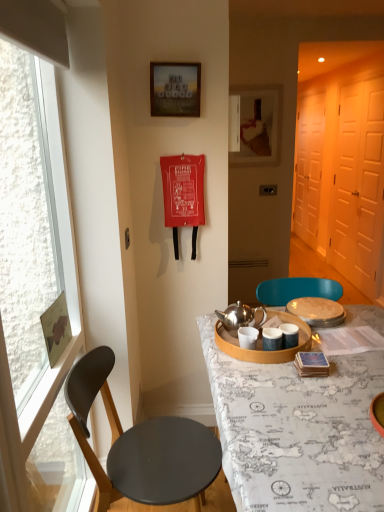
Question: Considering the positions of map-covered table at center and black matte chair at left in the image, is map-covered table at center wider or thinner than black matte chair at left?

Choices:
 (A) wide
 (B) thin

Answer: (A)

Question: Looking at the image, does map-covered table at center seem bigger or smaller compared to black matte chair at left?

Choices:
 (A) small
 (B) big

Answer: (B)

Question: Estimate the real-world distances between objects in this image. Which object is closer to the white matte door at right, which is counted as the 2th screen door, starting from the back?

Choices:
 (A) black matte chair at left
 (B) map-covered table at center
 (C) wooden picture frame at upper center, placed as the 2th picture frame when sorted from left to right
 (D) matte silver tray at center, which ranks as the 1th tableware in right-to-left order
 (E) clear glass window at left

Answer: (C)

Question: Considering the real-world distances, which object is closest to the white matte screen door at right, the 1th screen door when ordered from back to front?

Choices:
 (A) black matte chair at left
 (B) matte silver tray at center, which is the 2th tableware in left-to-right order
 (C) map-covered table at center
 (D) wooden frame at upper center, the 2th picture frame in the right-to-left sequence
 (E) clear glass window at left

Answer: (B)